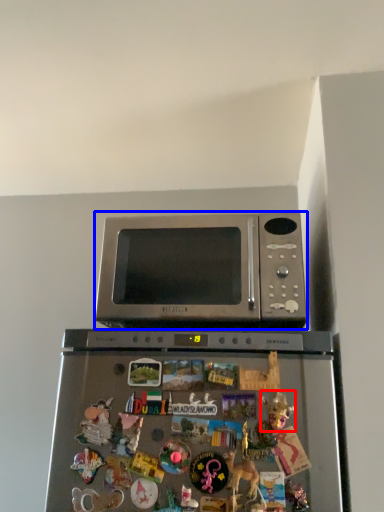
Question: Which point is closer to the camera, toy (highlighted by a red box) or microwave oven (highlighted by a blue box)?

Choices:
 (A) toy
 (B) microwave oven

Answer: (A)